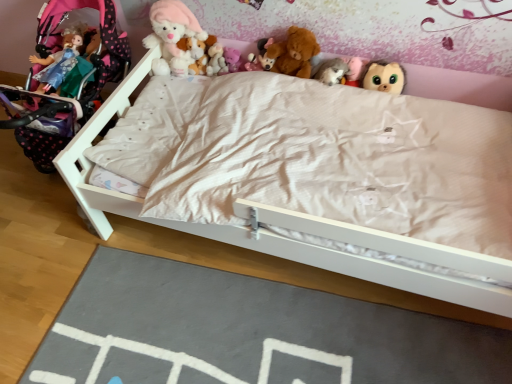
Question: Is slate at lower center smaller than fluffy plush toys at center, which is counted as the seventh toy, starting from the right?

Choices:
 (A) yes
 (B) no

Answer: (B)

Question: Is slate at lower center facing away from fluffy plush toys at center, which is the second toy from left to right?

Choices:
 (A) yes
 (B) no

Answer: (B)

Question: Is slate at lower center to the left of fluffy plush toys at center, which is the second toy from left to right, from the viewer's perspective?

Choices:
 (A) yes
 (B) no

Answer: (B)

Question: Can fluffy plush toys at center, which is counted as the seventh toy, starting from the right, be found inside slate at lower center?

Choices:
 (A) yes
 (B) no

Answer: (B)

Question: Is slate at lower center further to camera compared to fluffy plush toys at center, which is the second toy from left to right?

Choices:
 (A) yes
 (B) no

Answer: (B)

Question: In terms of width, does fluffy plush toys at upper center look wider or thinner when compared to fluffy brown plush at upper center, the first toy when ordered from right to left?

Choices:
 (A) thin
 (B) wide

Answer: (A)

Question: In the image, is fluffy plush toys at upper center positioned in front of or behind fluffy brown plush at upper center, the eighth toy in the left-to-right sequence?

Choices:
 (A) front
 (B) behind

Answer: (A)

Question: Considering the positions of fluffy plush toys at upper center and fluffy brown plush at upper center, the first toy when ordered from right to left, in the image, is fluffy plush toys at upper center bigger or smaller than fluffy brown plush at upper center, the first toy when ordered from right to left,?

Choices:
 (A) big
 (B) small

Answer: (A)

Question: From a real-world perspective, is fluffy plush toys at upper center physically located above or below fluffy brown plush at upper center, the eighth toy in the left-to-right sequence?

Choices:
 (A) below
 (B) above

Answer: (B)

Question: Visually, is fluffy brown teddy bear at upper center, arranged as the fourth toy when viewed from the left, positioned to the left or to the right of matte pink teddy bear at upper center, which is the sixth toy from right to left?

Choices:
 (A) left
 (B) right

Answer: (B)

Question: From the image's perspective, is fluffy brown teddy bear at upper center, arranged as the fourth toy when viewed from the left, positioned above or below matte pink teddy bear at upper center, which is the sixth toy from right to left?

Choices:
 (A) above
 (B) below

Answer: (A)

Question: Is point (x=258, y=59) closer or farther from the camera than point (x=224, y=57)?

Choices:
 (A) closer
 (B) farther

Answer: (A)

Question: In terms of height, does fluffy brown teddy bear at upper center, arranged as the fourth toy when viewed from the left, look taller or shorter compared to matte pink teddy bear at upper center, the third toy positioned from the left?

Choices:
 (A) tall
 (B) short

Answer: (A)

Question: Relative to fluffy plush toys at upper center, is fluffy pink teddy bear at upper center, which is counted as the 7th toy, starting from the left, in front or behind?

Choices:
 (A) front
 (B) behind

Answer: (B)

Question: Is fluffy pink teddy bear at upper center, which is counted as the 7th toy, starting from the left, wider or thinner than fluffy plush toys at upper center?

Choices:
 (A) thin
 (B) wide

Answer: (B)